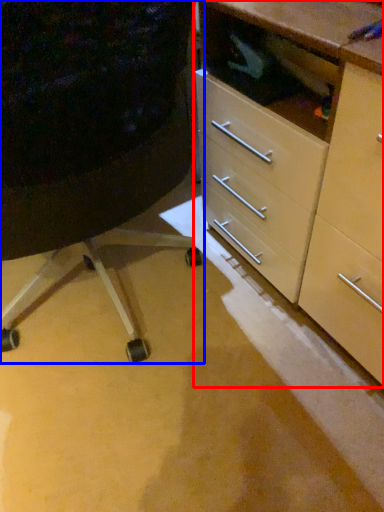
Question: Which object is closer to the camera taking this photo, chest of drawers (highlighted by a red box) or furniture (highlighted by a blue box)?

Choices:
 (A) chest of drawers
 (B) furniture

Answer: (B)